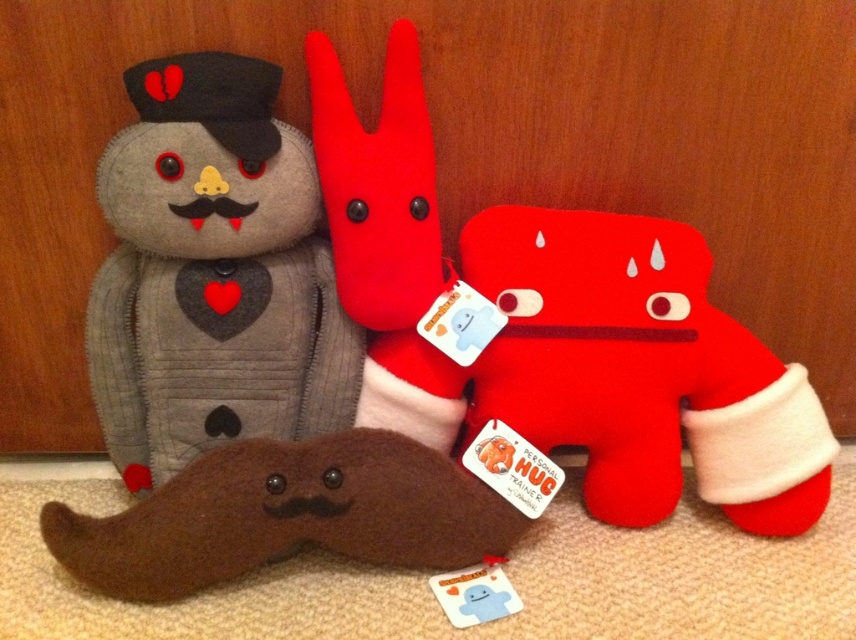
Question: Which of the following is the closest to the observer?

Choices:
 (A) (788, 440)
 (B) (372, 180)
 (C) (123, 285)

Answer: (B)

Question: Does gray felt bear at left lie behind matte red plush toy at center?

Choices:
 (A) yes
 (B) no

Answer: (B)

Question: Which point appears closest to the camera in this image?

Choices:
 (A) (387, 276)
 (B) (144, 404)

Answer: (A)

Question: Which of the following is the farthest from the observer?

Choices:
 (A) (107, 442)
 (B) (383, 192)
 (C) (542, 397)
 (D) (263, 502)

Answer: (A)

Question: Does matte red plush toy at center have a lesser width compared to velvet plush rabbit at center?

Choices:
 (A) no
 (B) yes

Answer: (A)

Question: Can you confirm if gray felt bear at left is positioned below brown fuzzy mustache at lower left?

Choices:
 (A) yes
 (B) no

Answer: (B)